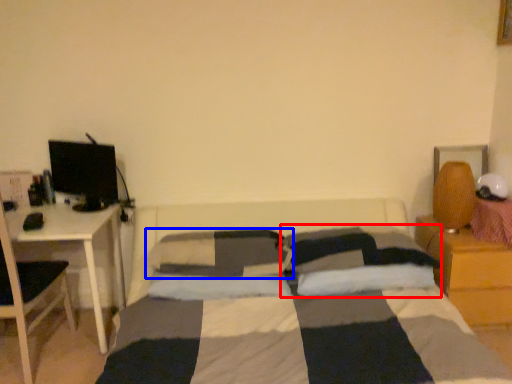
Question: Which point is closer to the camera, pillow (highlighted by a red box) or pillow (highlighted by a blue box)?

Choices:
 (A) pillow
 (B) pillow

Answer: (A)